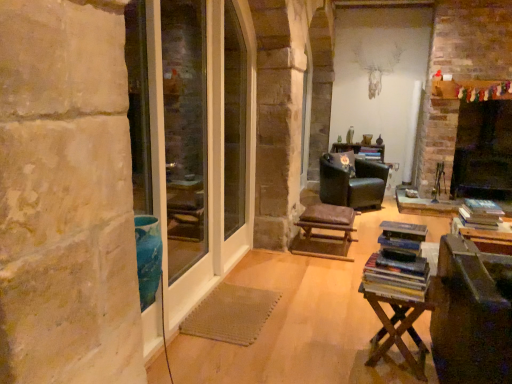
Where is `free space in front of brown leather stool at center`? The height and width of the screenshot is (384, 512). free space in front of brown leather stool at center is located at coordinates (321, 272).